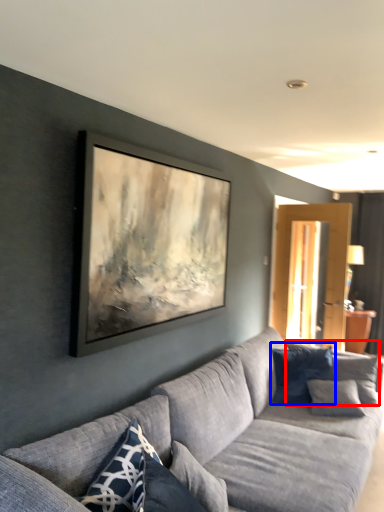
Question: Which of the following is the farthest to the observer, pillow (highlighted by a red box) or pillow (highlighted by a blue box)?

Choices:
 (A) pillow
 (B) pillow

Answer: (B)